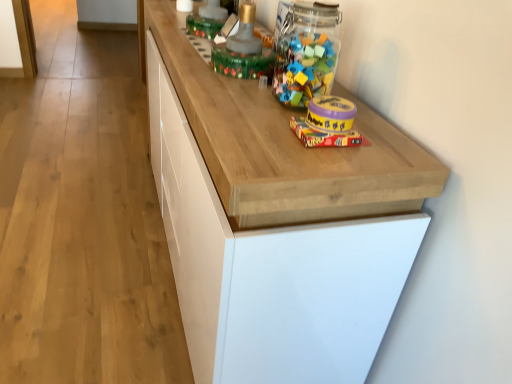
Question: Is wooden cabinet at center to the left or to the right of translucent plastic container at upper center, which appears as the 4th toy when ordered from the bottom, in the image?

Choices:
 (A) left
 (B) right

Answer: (B)

Question: Considering the positions of wooden cabinet at center and translucent plastic container at upper center, the 4th toy when ordered from front to back, in the image, is wooden cabinet at center bigger or smaller than translucent plastic container at upper center, the 4th toy when ordered from front to back,?

Choices:
 (A) big
 (B) small

Answer: (A)

Question: Which is nearer to the translucent plastic container at upper center, which appears as the 4th toy when ordered from the bottom?

Choices:
 (A) matte yellow plastic container at center, which is the fourth toy from top to bottom
 (B) wooden cabinet at center
 (C) matte yellow plastic container at upper right, which ranks as the third toy in top-to-bottom order
 (D) translucent glass jar at upper center, which is counted as the 2th toy, starting from the back

Answer: (D)

Question: Which is nearer to the matte yellow plastic container at upper right, positioned as the first toy in front-to-back order?

Choices:
 (A) wooden cabinet at center
 (B) translucent plastic container at upper center, which appears as the 4th toy when ordered from the bottom
 (C) matte yellow plastic container at center, the second toy in the front-to-back sequence
 (D) translucent glass jar at upper center, the second toy from the top

Answer: (C)